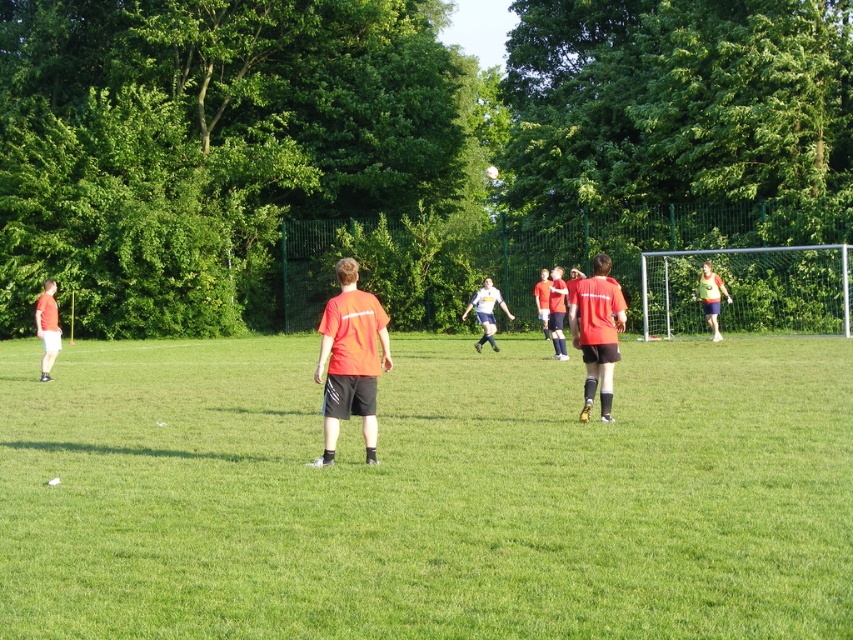
Question: Does white jersey at center have a greater width compared to green matte jersey at right?

Choices:
 (A) no
 (B) yes

Answer: (A)

Question: Considering the relative positions of green grass field at center and matte red shirt at center in the image provided, where is green grass field at center located with respect to matte red shirt at center?

Choices:
 (A) above
 (B) below

Answer: (B)

Question: Estimate the real-world distances between objects in this image. Which object is farther from the orange matte shirt at center?

Choices:
 (A) green grass field at center
 (B) white jersey at center
 (C) matte red shirt at center
 (D) green matte jersey at right

Answer: (B)

Question: Estimate the real-world distances between objects in this image. Which object is farther from the green matte jersey at right?

Choices:
 (A) green grass field at center
 (B) white jersey at center
 (C) matte red shirt at center

Answer: (C)

Question: Which point appears farthest from the camera in this image?

Choices:
 (A) (126, 504)
 (B) (373, 349)
 (C) (489, 276)
 (D) (595, 273)

Answer: (C)

Question: Considering the relative positions of matte red shirt at center and white jersey at center in the image provided, where is matte red shirt at center located with respect to white jersey at center?

Choices:
 (A) right
 (B) left

Answer: (A)